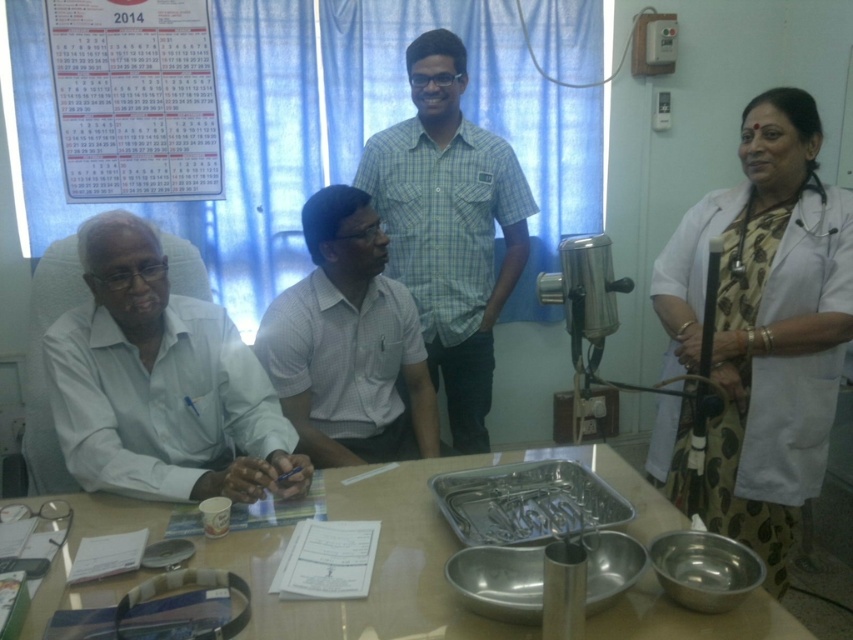
Question: Which object is positioned closest to the white paper calendar at upper left?

Choices:
 (A) white matte shirt at left
 (B) metallic table at center
 (C) white checkered shirt at center
 (D) white coat at right

Answer: (C)

Question: Which point is closer to the camera taking this photo?

Choices:
 (A) [724, 378]
 (B) [572, 531]

Answer: (B)

Question: Does green checkered shirt at center appear on the left side of silver metallic tray at center?

Choices:
 (A) yes
 (B) no

Answer: (A)

Question: Considering the real-world distances, which object is closest to the white matte shirt at left?

Choices:
 (A) white coat at right
 (B) white paper calendar at upper left
 (C) silver metallic tray at center
 (D) white checkered shirt at center

Answer: (D)

Question: Does metallic table at center lie behind white paper calendar at upper left?

Choices:
 (A) no
 (B) yes

Answer: (A)

Question: Is white checkered shirt at center positioned in front of white paper calendar at upper left?

Choices:
 (A) yes
 (B) no

Answer: (A)